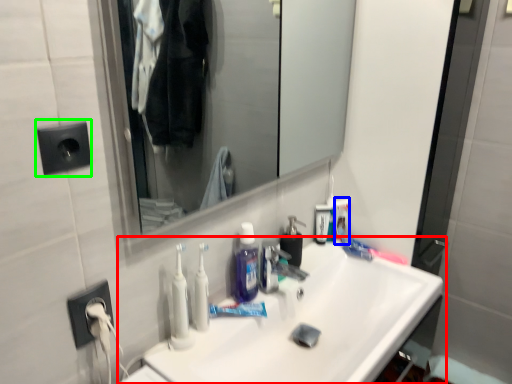
Question: Based on their relative distances, which object is nearer to sink (highlighted by a red box)? Choose from toiletry (highlighted by a blue box) and electric outlet (highlighted by a green box).

Choices:
 (A) toiletry
 (B) electric outlet

Answer: (A)